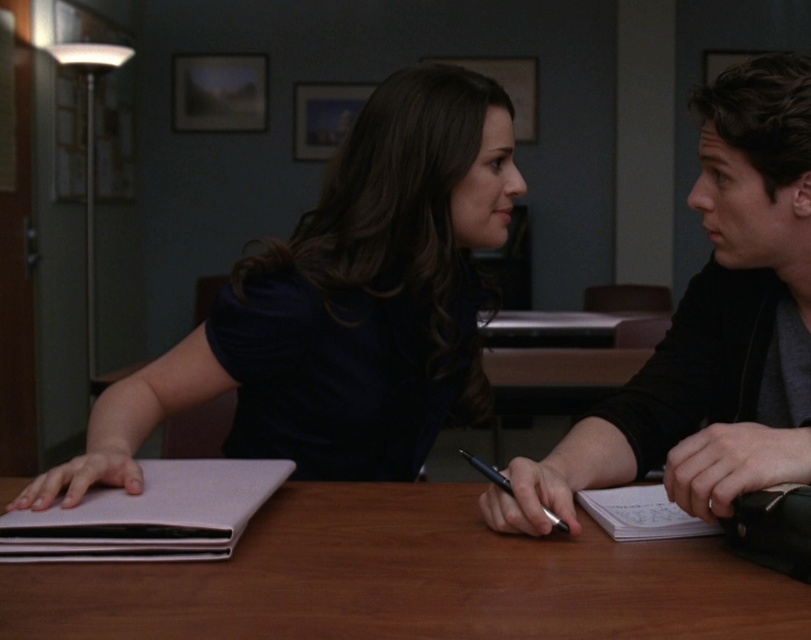
Does matte black laptop at center appear on the right side of wooden table at center?

No, matte black laptop at center is not to the right of wooden table at center.

Is matte black laptop at center wider than wooden table at center?

No.

Who is more distant from viewer, (468, 396) or (140, 596)?

The point (468, 396) is behind.

In order to click on matte black laptop at center in this screenshot , I will do `click(342, 305)`.

How much distance is there between wooden table at center and matte white notepad at left?

wooden table at center and matte white notepad at left are 5.55 inches apart from each other.

Is point (311, 540) positioned before point (140, 500)?

That is True.

At what (x,y) coordinates should I click in order to perform the action: click on wooden table at center. Please return your answer as a coordinate pair (x, y). Looking at the image, I should click on (408, 579).

Is matte black laptop at center to the left of black metallic pen at lower center from the viewer's perspective?

Yes, matte black laptop at center is to the left of black metallic pen at lower center.

Who is positioned more to the left, matte black laptop at center or black metallic pen at lower center?

From the viewer's perspective, matte black laptop at center appears more on the left side.

Image resolution: width=811 pixels, height=640 pixels. Find the location of `matte black laptop at center`. matte black laptop at center is located at coordinates (342, 305).